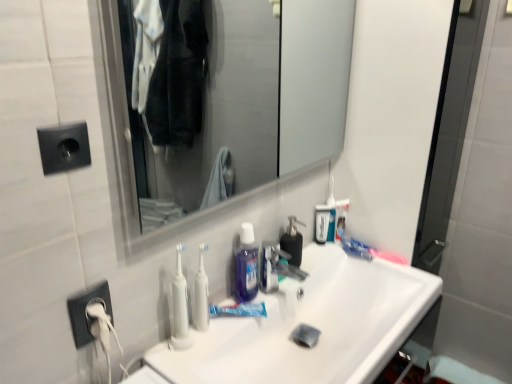
At what (x,y) coordinates should I click in order to perform the action: click on vacant space in front of translucent purple mouthwash at center, which is the first mouthwash from front to back. Please return your answer as a coordinate pair (x, y). This screenshot has width=512, height=384. Looking at the image, I should click on (181, 362).